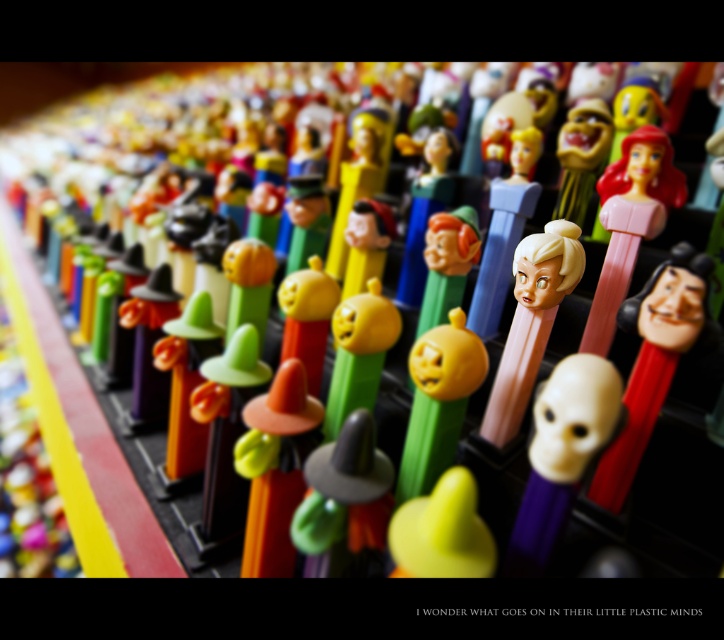
You are trying to place both the orange matte cone at center and the matte yellow plastic pumpkin at center on a shelf that can only hold one item. Based on their widths, which one should you choose to fit better?

The orange matte cone at center might be wider than the matte yellow plastic pumpkin at center, so it might not fit better. Choose the matte yellow plastic pumpkin at center instead.